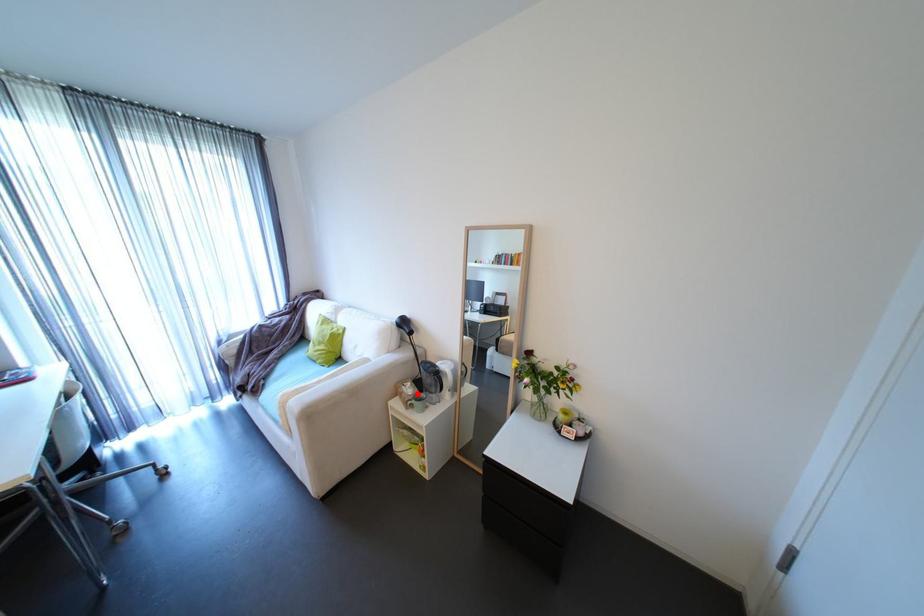
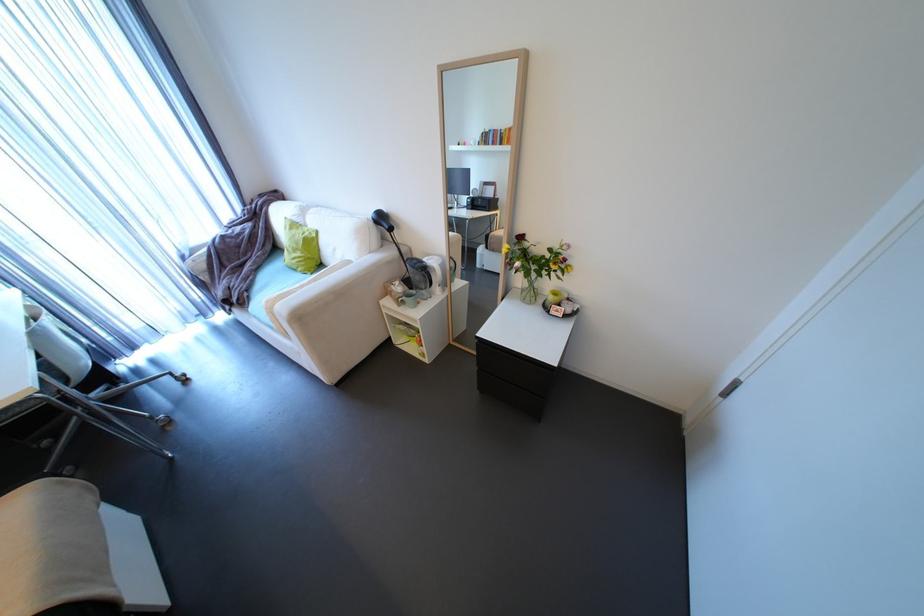
Question: I am providing you with two images of the same scene from different viewpoints. Image1 has a red point marked. In image2, the corresponding 3D location appears at what relative position? Reply with the corresponding letter.

Choices:
 (A) Closer
 (B) Farther

Answer: (A)